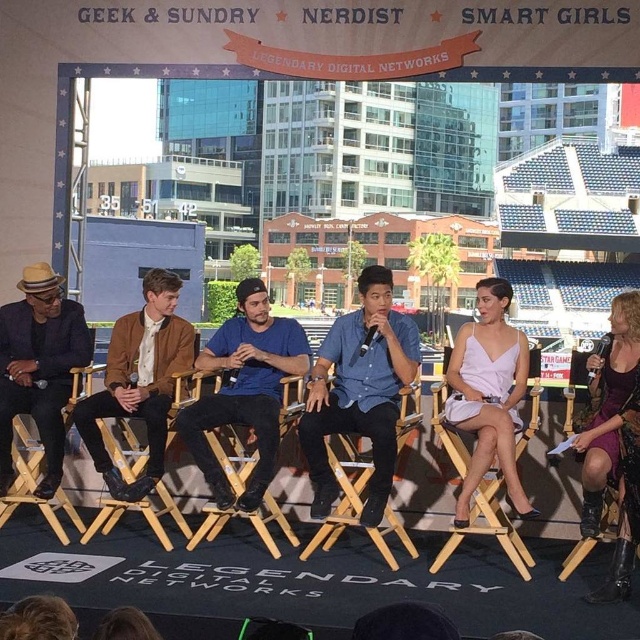
You are a photographer at the event and need to position yourself so that both the matte black suit at left and the white satin dress at center are in frame. Given that your camera has a fixed focal length, which person should you focus on to ensure both are clearly visible?

The matte black suit at left is not as tall as the white satin dress at center, so focusing on the white satin dress at center would ensure both are in clear view since it is taller and likely more prominent in the frame.

You are sitting in the audience watching the panel discussion. There are two points marked on the stage. The first point is at coordinate point (x=4, y=372) and the second is at point (x=474, y=333). Which point is closer to you?

Point (x=4, y=372) is closer to the viewer than point (x=474, y=333).